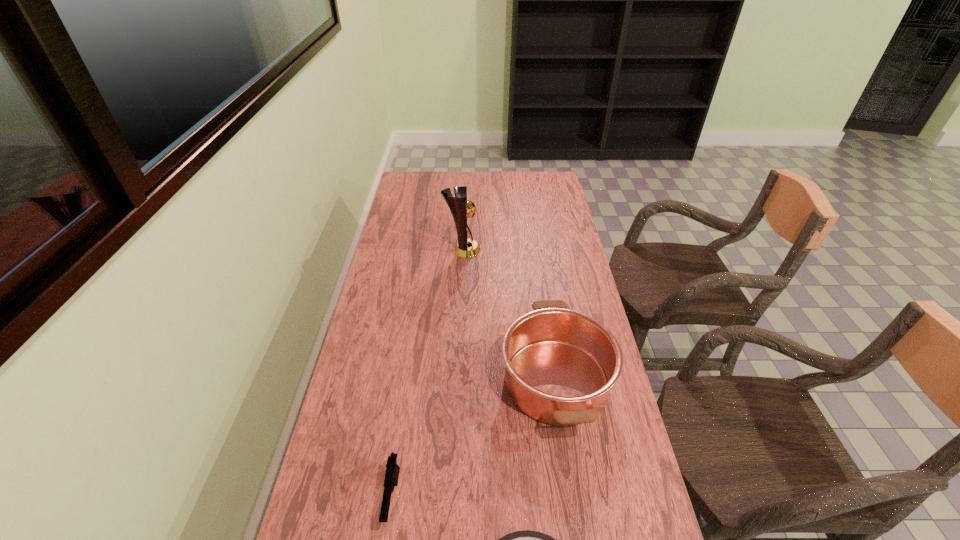
The height and width of the screenshot is (540, 960). In the image, there is a desktop. Find the location of `vacant region at the left edge`. vacant region at the left edge is located at coordinates (372, 323).

This screenshot has width=960, height=540. What are the coordinates of `vacant region at the right edge of the desktop` in the screenshot? It's located at (563, 211).

The height and width of the screenshot is (540, 960). What are the coordinates of `free point between the pistol and the tallest object` in the screenshot? It's located at (427, 374).

At what (x,y) coordinates should I click in order to perform the action: click on unoccupied position between the leftmost object and the saucepan. Please return your answer as a coordinate pair (x, y). Looking at the image, I should click on (474, 440).

I want to click on vacant point located between the leftmost object and the saucepan, so click(474, 440).

The image size is (960, 540). What are the coordinates of `free spot between the farthest object and the third farthest object` in the screenshot? It's located at (427, 374).

Identify the location of free point between the farthest object and the saucepan. tap(509, 315).

At what (x,y) coordinates should I click in order to perform the action: click on object that ranks as the second closest to the stew. Please return your answer as a coordinate pair (x, y). Looking at the image, I should click on (560, 364).

Select which object is the third closest to the nearest object. Please provide its 2D coordinates. Your answer should be formatted as a tuple, i.e. [(x, y)], where the tuple contains the x and y coordinates of a point satisfying the conditions above.

[(466, 248)]

Where is `blank space that satisfies the following two spatial constraints: 1. at the front of the saucepan, where the globe is visible; 2. on the left side of the award`? blank space that satisfies the following two spatial constraints: 1. at the front of the saucepan, where the globe is visible; 2. on the left side of the award is located at coordinates (456, 381).